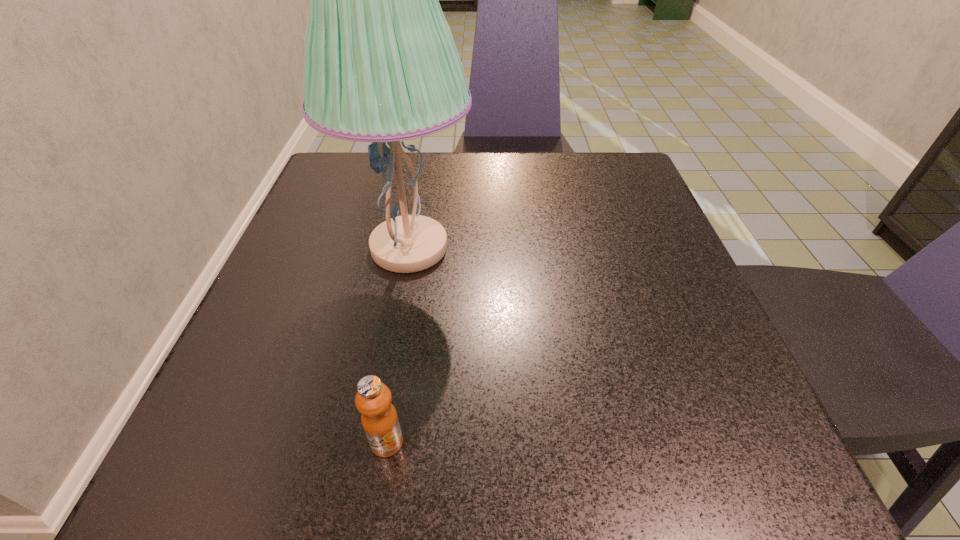
Find the location of a particular element. The image size is (960, 540). vacant space at the right edge of the desktop is located at coordinates [645, 240].

The image size is (960, 540). Find the location of `vacant area at the far right corner`. vacant area at the far right corner is located at coordinates (593, 163).

Where is `free space at the near right corner`? Image resolution: width=960 pixels, height=540 pixels. free space at the near right corner is located at coordinates (759, 433).